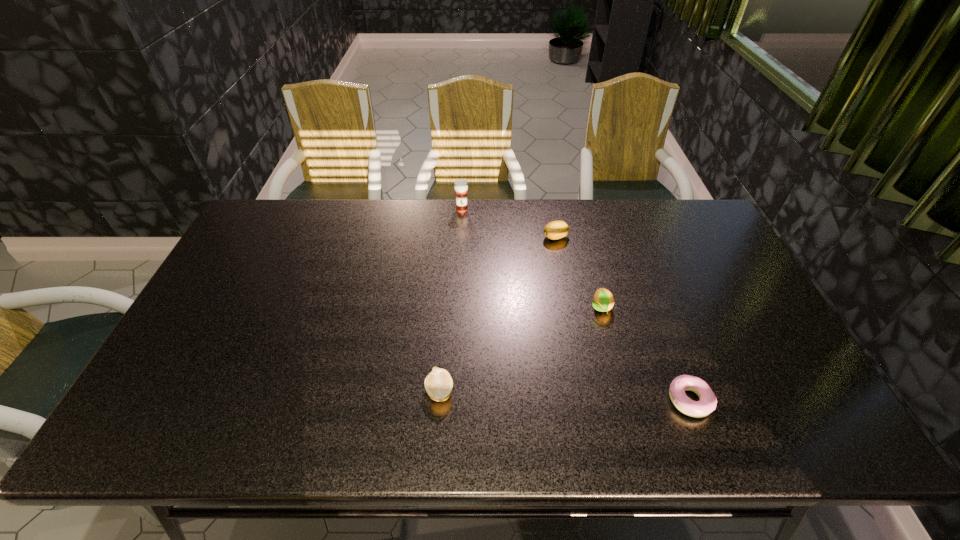
Find the location of a particular element. The width and height of the screenshot is (960, 540). free region at the near edge is located at coordinates (287, 412).

Locate an element on the screen. vacant space at the left edge of the desktop is located at coordinates (252, 259).

This screenshot has width=960, height=540. In the image, there is a desktop. What are the coordinates of `vacant area at the right edge` in the screenshot? It's located at click(x=743, y=360).

Find the location of `vacant region at the near right corner of the desktop`. vacant region at the near right corner of the desktop is located at coordinates (764, 419).

Identify the location of free space between the shortest lemon and the fourth object from left to right. (520, 349).

Where is `free space between the rightmost object and the farthest object`? free space between the rightmost object and the farthest object is located at coordinates 576,305.

Where is `free space that is in between the nearest lemon and the tallest object`? The width and height of the screenshot is (960, 540). free space that is in between the nearest lemon and the tallest object is located at coordinates (450, 301).

Where is `free space between the third object from left to right and the leftmost lemon`? This screenshot has height=540, width=960. free space between the third object from left to right and the leftmost lemon is located at coordinates (497, 314).

Image resolution: width=960 pixels, height=540 pixels. In order to click on vacant space in between the shortest lemon and the farthest lemon in this screenshot , I will do `click(497, 314)`.

Find the location of a particular element. The image size is (960, 540). free space between the third farthest object and the shortest lemon is located at coordinates (520, 349).